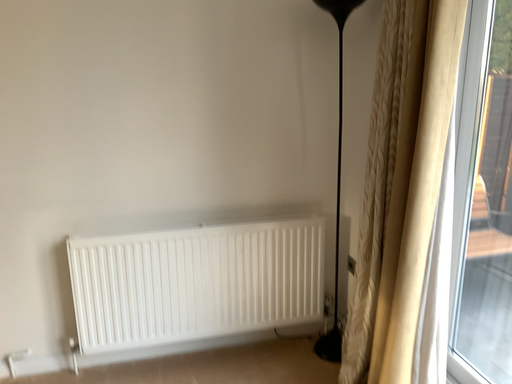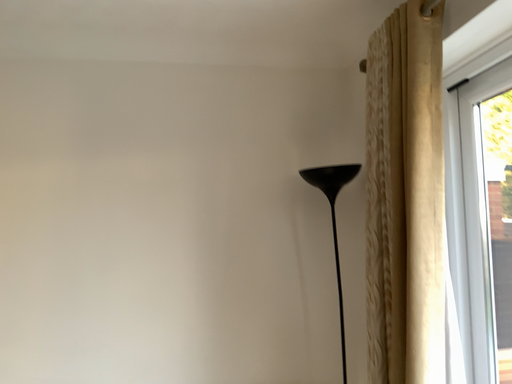
Question: Which way did the camera rotate in the video?

Choices:
 (A) rotated upward
 (B) rotated downward

Answer: (A)